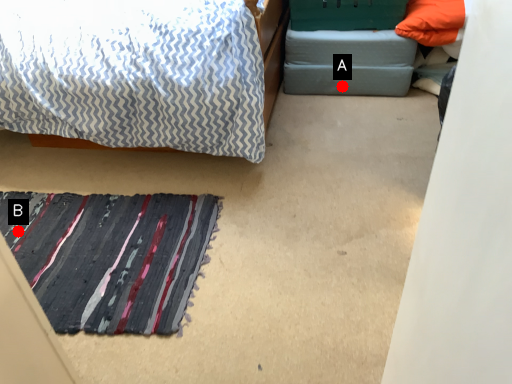
Question: Two points are circled on the image, labeled by A and B beside each circle. Which point is closer to the camera taking this photo?

Choices:
 (A) A is closer
 (B) B is closer

Answer: (B)